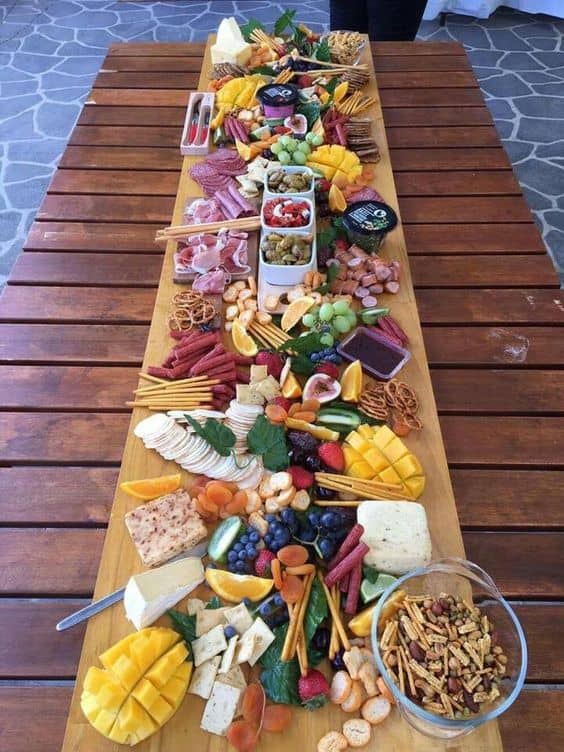
Where is `wood plank`? Image resolution: width=564 pixels, height=752 pixels. wood plank is located at coordinates (486, 244).